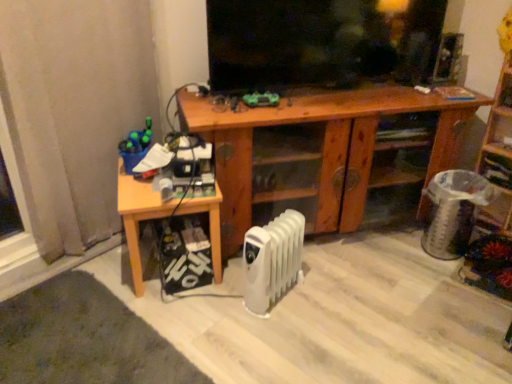
Question: Considering the relative sizes of wooden bookshelf at right and wooden cabinet at center in the image provided, is wooden bookshelf at right shorter than wooden cabinet at center?

Choices:
 (A) yes
 (B) no

Answer: (B)

Question: Is wooden bookshelf at right oriented towards wooden cabinet at center?

Choices:
 (A) yes
 (B) no

Answer: (B)

Question: Can you confirm if wooden bookshelf at right is taller than wooden cabinet at center?

Choices:
 (A) yes
 (B) no

Answer: (A)

Question: Considering the relative positions of wooden bookshelf at right and wooden cabinet at center in the image provided, is wooden bookshelf at right to the right of wooden cabinet at center from the viewer's perspective?

Choices:
 (A) yes
 (B) no

Answer: (A)

Question: From a real-world perspective, is wooden bookshelf at right positioned under wooden cabinet at center based on gravity?

Choices:
 (A) yes
 (B) no

Answer: (B)

Question: Relative to wooden bookshelf at right, is green matte toy at center, which appears as the 1th toy when viewed from the right, in front or behind?

Choices:
 (A) front
 (B) behind

Answer: (B)

Question: Considering the relative positions of green matte toy at center, the 2th toy ordered from the bottom, and wooden bookshelf at right in the image provided, is green matte toy at center, the 2th toy ordered from the bottom, to the left or to the right of wooden bookshelf at right?

Choices:
 (A) left
 (B) right

Answer: (A)

Question: Is green matte toy at center, placed as the second toy when sorted from left to right, wider or thinner than wooden bookshelf at right?

Choices:
 (A) wide
 (B) thin

Answer: (B)

Question: Is green matte toy at center, placed as the second toy when sorted from left to right, inside the boundaries of wooden bookshelf at right, or outside?

Choices:
 (A) inside
 (B) outside

Answer: (B)

Question: From a real-world perspective, relative to white plastic radiator at lower center, is matte plastic pen holder at left, positioned as the second toy in right-to-left order, vertically above or below?

Choices:
 (A) above
 (B) below

Answer: (A)

Question: Visually, is matte plastic pen holder at left, positioned as the second toy in right-to-left order, positioned to the left or to the right of white plastic radiator at lower center?

Choices:
 (A) left
 (B) right

Answer: (A)

Question: From the image's perspective, is matte plastic pen holder at left, the second toy when ordered from top to bottom, positioned above or below white plastic radiator at lower center?

Choices:
 (A) below
 (B) above

Answer: (B)

Question: Is point (139, 139) positioned closer to the camera than point (252, 281)?

Choices:
 (A) farther
 (B) closer

Answer: (A)

Question: In terms of height, does wooden cabinet at center look taller or shorter compared to green matte toy at center, placed as the second toy when sorted from left to right?

Choices:
 (A) short
 (B) tall

Answer: (B)

Question: Which is correct: wooden cabinet at center is inside green matte toy at center, placed as the second toy when sorted from left to right, or outside of it?

Choices:
 (A) inside
 (B) outside

Answer: (B)